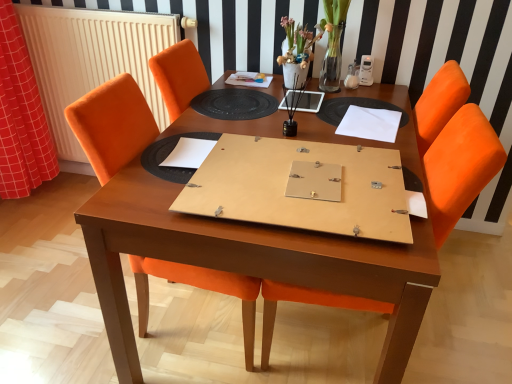
Question: Considering the relative sizes of wooden table at center and white paper at center, placed as the 1th notebook when sorted from bottom to top, in the image provided, is wooden table at center wider than white paper at center, placed as the 1th notebook when sorted from bottom to top,?

Choices:
 (A) no
 (B) yes

Answer: (B)

Question: Would you say wooden table at center is outside white paper at center, the 2th notebook when ordered from back to front?

Choices:
 (A) yes
 (B) no

Answer: (A)

Question: Is the position of wooden table at center less distant than that of white paper at center, acting as the 2th notebook starting from the top?

Choices:
 (A) no
 (B) yes

Answer: (B)

Question: Is wooden table at center aimed at white paper at center, acting as the first notebook starting from the left?

Choices:
 (A) yes
 (B) no

Answer: (B)

Question: From the image's perspective, is wooden table at center above white paper at center, which is the first notebook from front to back?

Choices:
 (A) yes
 (B) no

Answer: (B)

Question: Considering the relative sizes of wooden table at center and white paper at center, which is the first notebook from front to back, in the image provided, is wooden table at center shorter than white paper at center, which is the first notebook from front to back,?

Choices:
 (A) yes
 (B) no

Answer: (B)

Question: Is black rubber placemat at center far from orange fabric chair at center, the 1th chair from the left?

Choices:
 (A) no
 (B) yes

Answer: (A)

Question: Is black rubber placemat at center beside orange fabric chair at center, the 1th chair from the left?

Choices:
 (A) no
 (B) yes

Answer: (A)

Question: Is orange fabric chair at center, the 2th chair when ordered from right to left, a part of black rubber placemat at center?

Choices:
 (A) no
 (B) yes

Answer: (A)

Question: Considering the relative positions of black rubber placemat at center and orange fabric chair at center, the 2th chair when ordered from right to left, in the image provided, is black rubber placemat at center to the left of orange fabric chair at center, the 2th chair when ordered from right to left, from the viewer's perspective?

Choices:
 (A) yes
 (B) no

Answer: (B)

Question: Is black rubber placemat at center further to camera compared to orange fabric chair at center, the 1th chair from the left?

Choices:
 (A) yes
 (B) no

Answer: (A)

Question: Considering the relative sizes of black rubber placemat at center and orange fabric chair at center, the 1th chair from the left, in the image provided, is black rubber placemat at center bigger than orange fabric chair at center, the 1th chair from the left,?

Choices:
 (A) no
 (B) yes

Answer: (A)

Question: Is orange fabric chair at center, which appears as the 2th chair when viewed from the left, at the left side of red checkered fabric at left?

Choices:
 (A) no
 (B) yes

Answer: (A)